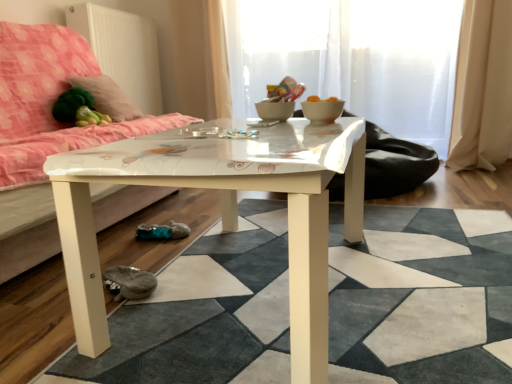
You are a GUI agent. You are given a task and a screenshot of the screen. Output one action in this format:
    pyautogui.click(x=<x>, y=<y>)
    Task: Click on the vacant area situated below white glossy table at center (from a real-world perspective)
    This screenshot has width=512, height=384.
    Given the screenshot: What is the action you would take?
    pyautogui.click(x=387, y=283)